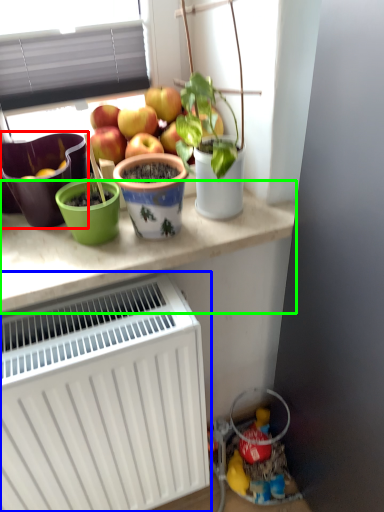
Question: Which object is the closest to the flowerpot (highlighted by a red box)? Choose among these: radiator (highlighted by a blue box) or table (highlighted by a green box).

Choices:
 (A) radiator
 (B) table

Answer: (B)